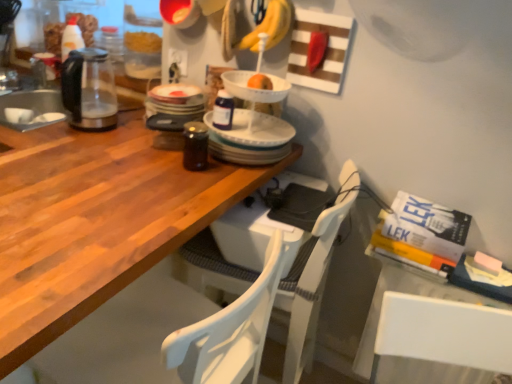
Find the location of a particular element. vacant space in front of transparent glass kettle at left is located at coordinates (76, 155).